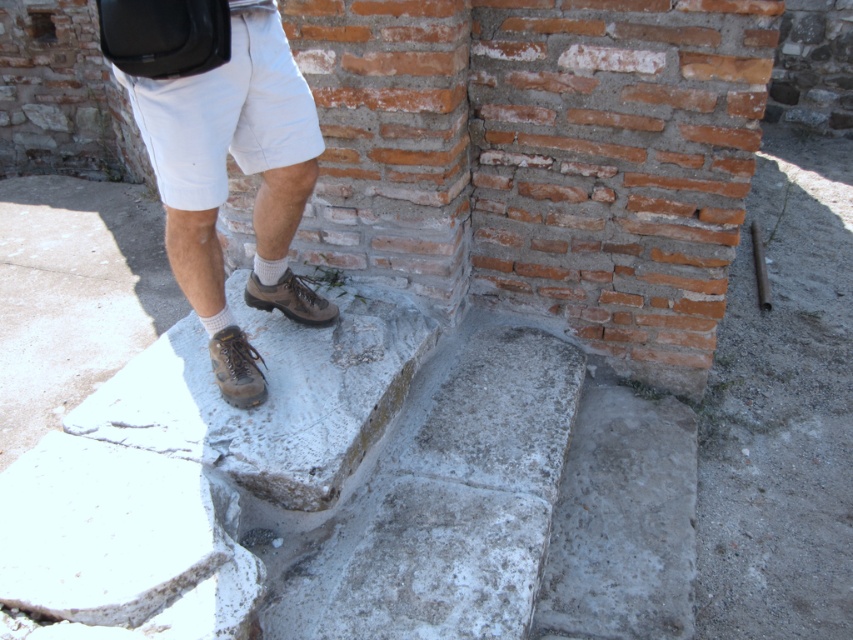
Question: Is brown leather shoes at lower center to the left of brown leather boot at center from the viewer's perspective?

Choices:
 (A) yes
 (B) no

Answer: (B)

Question: Which is farther from the brown leather boot at center?

Choices:
 (A) white cotton shorts at upper left
 (B) brown leather shoes at lower center
 (C) brown suede shoe at center

Answer: (A)

Question: Is brown leather boot at center behind brown suede shoe at center?

Choices:
 (A) yes
 (B) no

Answer: (B)

Question: Which of the following is the farthest from the observer?

Choices:
 (A) white cotton shorts at upper left
 (B) brown leather boot at center
 (C) brown suede shoe at center
 (D) brown leather shoes at lower center

Answer: (C)

Question: Which object is the farthest from the brown suede shoe at center?

Choices:
 (A) brown leather shoes at lower center
 (B) white cotton shorts at upper left
 (C) brown leather boot at center

Answer: (B)

Question: Can you confirm if white cotton shorts at upper left is positioned below brown suede shoe at center?

Choices:
 (A) no
 (B) yes

Answer: (A)